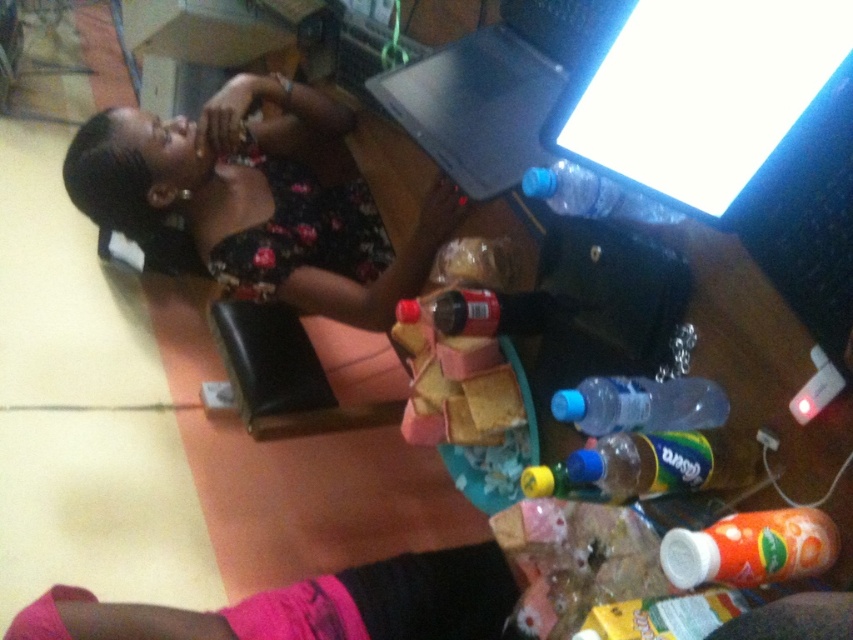
You are organizing a small event and need to decide which item to move first. The black floral dress at upper left and the wooden table at center are both in your way. Based on their sizes, which one should you move first to clear more space?

The black floral dress at upper left is bigger than the wooden table at center, so you should move it first to clear more space.

You are organizing a photoshoot and need to decide which item to adjust first. Based on their sizes, which object should you consider moving first if you want to free up more space? The black floral dress at upper left or the wooden table at center?

The black floral dress at upper left has a larger width than the wooden table at center, so moving the black floral dress at upper left first would free up more space.